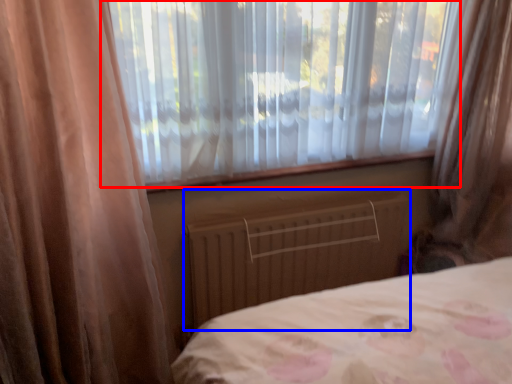
Question: Among these objects, which one is farthest to the camera, window (highlighted by a red box) or radiator (highlighted by a blue box)?

Choices:
 (A) window
 (B) radiator

Answer: (B)